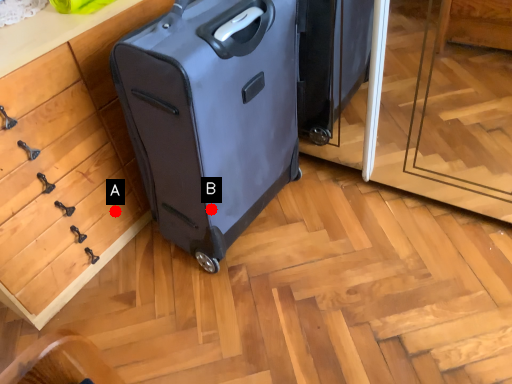
Question: Two points are circled on the image, labeled by A and B beside each circle. Which point is farther from the camera taking this photo?

Choices:
 (A) A is further
 (B) B is further

Answer: (A)